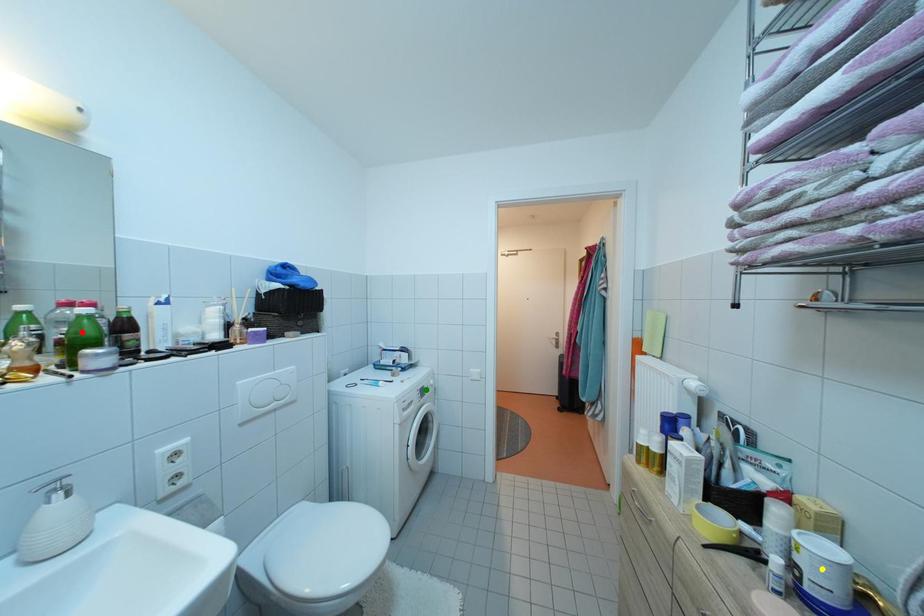
Order these from nearest to farthest:
yellow point | green point | red point

yellow point, red point, green point